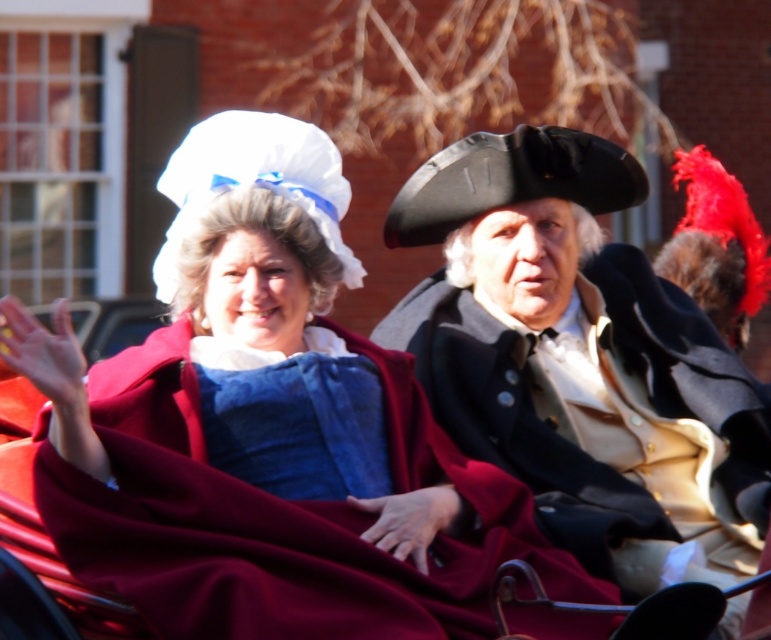
Question: Does matte blue fabric dress at center appear over matte black coat at center?

Choices:
 (A) no
 (B) yes

Answer: (B)

Question: Does matte blue fabric dress at center appear on the left side of matte black coat at center?

Choices:
 (A) yes
 (B) no

Answer: (A)

Question: Which object is farther from the camera taking this photo?

Choices:
 (A) matte blue fabric dress at center
 (B) matte black coat at center

Answer: (B)

Question: Is matte blue fabric dress at center closer to the viewer compared to matte black coat at center?

Choices:
 (A) no
 (B) yes

Answer: (B)